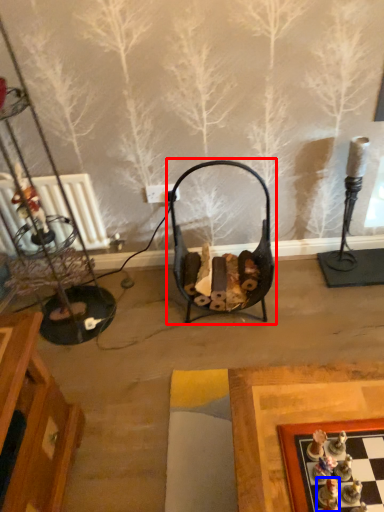
Question: Among these objects, which one is farthest to the camera, swivel chair (highlighted by a red box) or toy (highlighted by a blue box)?

Choices:
 (A) swivel chair
 (B) toy

Answer: (A)